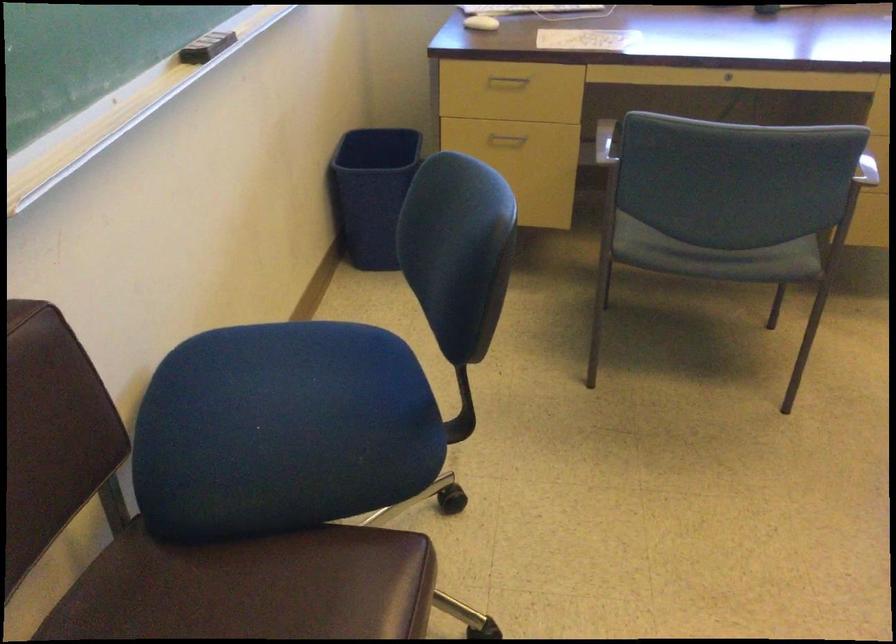
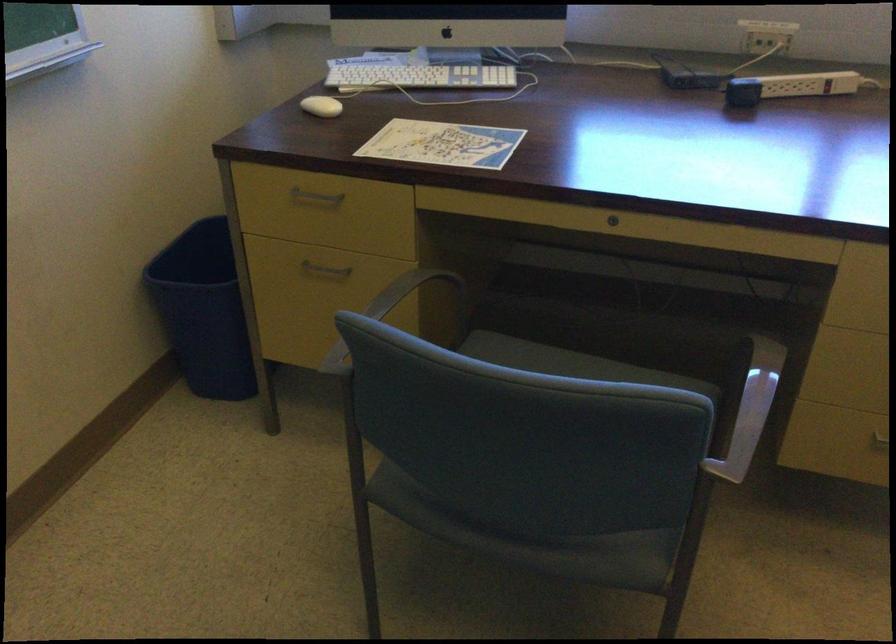
Locate, in the second image, the point that corresponds to the point at 505,77 in the first image.

(315, 196)